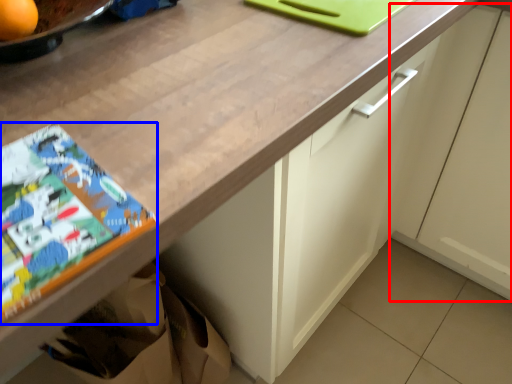
Question: Which object appears farthest to the camera in this image, cabinetry (highlighted by a red box) or comic book (highlighted by a blue box)?

Choices:
 (A) cabinetry
 (B) comic book

Answer: (A)